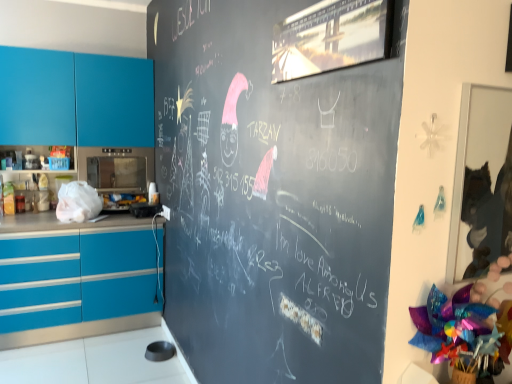
Question: From the image's perspective, is teal glossy cabinets at left located above or below satin silver microwave at left, which ranks as the 1th appliance in top-to-bottom order?

Choices:
 (A) below
 (B) above

Answer: (B)

Question: Considering the positions of teal glossy cabinets at left and satin silver microwave at left, which ranks as the 1th appliance in top-to-bottom order, in the image, is teal glossy cabinets at left bigger or smaller than satin silver microwave at left, which ranks as the 1th appliance in top-to-bottom order,?

Choices:
 (A) big
 (B) small

Answer: (A)

Question: Estimate the real-world distances between objects in this image. Which object is farther from the satin silver microwave at left, which ranks as the 1th appliance in top-to-bottom order?

Choices:
 (A) teal glossy cabinets at left
 (B) metallic microwave at center-left, marked as the first appliance in a bottom-to-top arrangement

Answer: (B)

Question: Estimate the real-world distances between objects in this image. Which object is closer to the metallic microwave at center-left, marked as the first appliance in a bottom-to-top arrangement?

Choices:
 (A) teal glossy cabinets at left
 (B) satin silver microwave at left, which ranks as the 1th appliance in top-to-bottom order

Answer: (B)